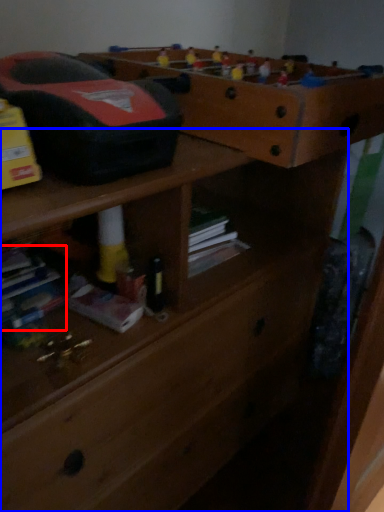
Question: Which object appears closest to the camera in this image, book (highlighted by a red box) or chest of drawers (highlighted by a blue box)?

Choices:
 (A) book
 (B) chest of drawers

Answer: (B)